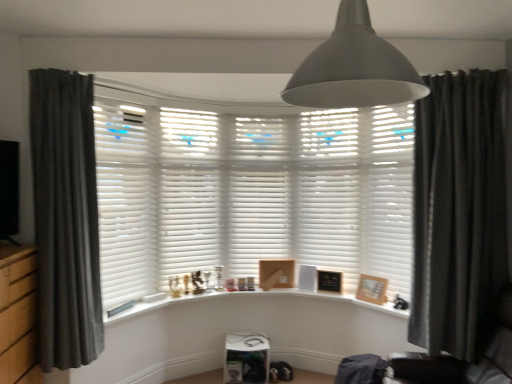
Where is `dark grey velvet curtain at right, placed as the first curtain when sorted from right to left`? dark grey velvet curtain at right, placed as the first curtain when sorted from right to left is located at coordinates point(458,211).

What is the approximate height of matte gray lampshade at upper center?

It is 34.40 centimeters.

Find the location of a particular element. black leather swivel chair at lower right is located at coordinates (460, 360).

Image resolution: width=512 pixels, height=384 pixels. Describe the element at coordinates (258, 194) in the screenshot. I see `white matte shutter at center, which appears as the 3th shutter when viewed from the left` at that location.

Image resolution: width=512 pixels, height=384 pixels. In order to click on white matte shutter at center, which appears as the 5th shutter when viewed from the left in this screenshot , I will do `click(386, 194)`.

Which object is closer to the camera, white wood window sill at center or wooden picture frame at center, positioned as the third picture frame in front-to-back order?

white wood window sill at center is in front.

In terms of size, does white wood window sill at center appear bigger or smaller than wooden picture frame at center, which is the first picture frame in back-to-front order?

white wood window sill at center is bigger than wooden picture frame at center, which is the first picture frame in back-to-front order.

Could wooden picture frame at center, which is the first picture frame in back-to-front order, be considered to be inside white wood window sill at center?

No, wooden picture frame at center, which is the first picture frame in back-to-front order, is not inside white wood window sill at center.

Can you confirm if wooden picture frame at center, which is the first picture frame in back-to-front order, is positioned to the left of white matte shutter at center, which is the 4th shutter from left to right?

Correct, you'll find wooden picture frame at center, which is the first picture frame in back-to-front order, to the left of white matte shutter at center, which is the 4th shutter from left to right.

Do you think wooden picture frame at center, which is the first picture frame in back-to-front order, is within white matte shutter at center, which is the 2th shutter from right to left, or outside of it?

wooden picture frame at center, which is the first picture frame in back-to-front order, is spatially situated outside white matte shutter at center, which is the 2th shutter from right to left.

From a real-world perspective, is wooden picture frame at center, acting as the third picture frame starting from the right, on white matte shutter at center, which is the 4th shutter from left to right?

Incorrect, from a real-world perspective, wooden picture frame at center, acting as the third picture frame starting from the right, is lower than white matte shutter at center, which is the 4th shutter from left to right.

Is black leather swivel chair at lower right behind dark grey fabric curtain at left, which appears as the first curtain when viewed from the left?

No, it is in front of dark grey fabric curtain at left, which appears as the first curtain when viewed from the left.

Can you confirm if black leather swivel chair at lower right is wider than dark grey fabric curtain at left, which ranks as the second curtain in right-to-left order?

Yes, black leather swivel chair at lower right is wider than dark grey fabric curtain at left, which ranks as the second curtain in right-to-left order.

Which is in front, point (495, 356) or point (74, 351)?

The point (495, 356) is in front.

Can you tell me how much black leather swivel chair at lower right and dark grey fabric curtain at left, which ranks as the second curtain in right-to-left order, differ in facing direction?

97.2 degrees.

Relative to white matte shutter at center, the fourth shutter when ordered from right to left, is white matte shutter at center, which is the 1th shutter from right to left, in front or behind?

white matte shutter at center, which is the 1th shutter from right to left, is positioned closer to the viewer than white matte shutter at center, the fourth shutter when ordered from right to left.

Which of these two, white matte shutter at center, which appears as the 5th shutter when viewed from the left, or white matte shutter at center, the 2th shutter from the left, stands shorter?

white matte shutter at center, which appears as the 5th shutter when viewed from the left.

Is white matte shutter at center, which is the 1th shutter from right to left, looking in the opposite direction of white matte shutter at center, the fourth shutter when ordered from right to left?

That's not correct — white matte shutter at center, which is the 1th shutter from right to left, is not looking away from white matte shutter at center, the fourth shutter when ordered from right to left.

Is white matte shutter at center, which is the 1th shutter from right to left, not inside white matte shutter at center, the 2th shutter from the left?

Yes, white matte shutter at center, which is the 1th shutter from right to left, is not within white matte shutter at center, the 2th shutter from the left.

Can you tell me how much white matte shutter at center, which is the 1th shutter from right to left, and white matte shutter at left, the fifth shutter viewed from the right, differ in facing direction?

105 degrees separate the facing orientations of white matte shutter at center, which is the 1th shutter from right to left, and white matte shutter at left, the fifth shutter viewed from the right.

From a real-world perspective, is white matte shutter at center, which is the 1th shutter from right to left, positioned above or below white matte shutter at left, placed as the first shutter when sorted from left to right?

white matte shutter at center, which is the 1th shutter from right to left, is situated lower than white matte shutter at left, placed as the first shutter when sorted from left to right, in the real world.

Is white matte shutter at left, the fifth shutter viewed from the right, a part of white matte shutter at center, which is the 1th shutter from right to left?

No, white matte shutter at left, the fifth shutter viewed from the right, is located outside of white matte shutter at center, which is the 1th shutter from right to left.

Between white matte shutter at center, which appears as the 5th shutter when viewed from the left, and white matte shutter at left, the fifth shutter viewed from the right, which one has more height?

Standing taller between the two is white matte shutter at left, the fifth shutter viewed from the right.

Is white matte shutter at center, the fourth shutter when ordered from right to left, beside white matte shutter at center, which appears as the 3th shutter when viewed from the left?

They are not placed beside each other.

Which shutter is the 1st one when counting from the right side of the white matte shutter at center, the 2th shutter from the left? Please provide its 2D coordinates.

[(258, 194)]

Is the position of white matte shutter at center, the 2th shutter from the left, more distant than that of white matte shutter at center, the third shutter positioned from the right?

No, it is in front of white matte shutter at center, the third shutter positioned from the right.

Does white wood window sill at center come behind white matte shutter at left, the fifth shutter viewed from the right?

Yes, the depth of white wood window sill at center is greater than that of white matte shutter at left, the fifth shutter viewed from the right.

Between white wood window sill at center and white matte shutter at left, placed as the first shutter when sorted from left to right, which one appears on the left side from the viewer's perspective?

From the viewer's perspective, white matte shutter at left, placed as the first shutter when sorted from left to right, appears more on the left side.

Considering the sizes of objects white wood window sill at center and white matte shutter at left, placed as the first shutter when sorted from left to right, in the image provided, who is thinner, white wood window sill at center or white matte shutter at left, placed as the first shutter when sorted from left to right,?

With smaller width is white matte shutter at left, placed as the first shutter when sorted from left to right.

Considering the sizes of objects white wood window sill at center and white matte shutter at left, placed as the first shutter when sorted from left to right, in the image provided, who is smaller, white wood window sill at center or white matte shutter at left, placed as the first shutter when sorted from left to right,?

white wood window sill at center.

The image size is (512, 384). I want to click on the 1st picture frame counting from the right of the white wood window sill at center, so click(x=276, y=274).

Locate an element on the screen. Image resolution: width=512 pixels, height=384 pixels. the 2nd picture frame behind when counting from the white matte shutter at center, which is the 2th shutter from right to left is located at coordinates (276, 274).

From the image, which object appears to be farther from black leather swivel chair at lower right, white matte shutter at center, which appears as the 3th shutter when viewed from the left, or dark grey fabric curtain at left, which ranks as the second curtain in right-to-left order?

dark grey fabric curtain at left, which ranks as the second curtain in right-to-left order, lies further to black leather swivel chair at lower right than the other object.

Based on their spatial positions, is white matte shutter at center, which is the 2th shutter from right to left, or white wood window sill at center closer to dark grey velvet curtain at right, placed as the first curtain when sorted from right to left?

Among the two, white matte shutter at center, which is the 2th shutter from right to left, is located nearer to dark grey velvet curtain at right, placed as the first curtain when sorted from right to left.

Estimate the real-world distances between objects in this image. Which object is closer to black leather swivel chair at lower right, dark grey fabric curtain at left, which ranks as the second curtain in right-to-left order, or black matte picture frame at center, the second picture frame in the right-to-left sequence?

The object closer to black leather swivel chair at lower right is black matte picture frame at center, the second picture frame in the right-to-left sequence.

When comparing their distances from white matte shutter at center, which appears as the 5th shutter when viewed from the left, does white matte shutter at center, which is the 2th shutter from right to left, or black leather swivel chair at lower right seem closer?

white matte shutter at center, which is the 2th shutter from right to left, lies closer to white matte shutter at center, which appears as the 5th shutter when viewed from the left, than the other object.

Considering their positions, is dark grey velvet curtain at right, which is counted as the 2th curtain, starting from the left, positioned closer to white matte shutter at center, which appears as the 3th shutter when viewed from the left, than wooden picture frame at right, which is the 1th picture frame in right-to-left order?

wooden picture frame at right, which is the 1th picture frame in right-to-left order, lies closer to white matte shutter at center, which appears as the 3th shutter when viewed from the left, than the other object.

Based on their spatial positions, is dark grey velvet curtain at right, placed as the first curtain when sorted from right to left, or white matte shutter at center, which appears as the 3th shutter when viewed from the left, closer to white matte shutter at left, the fifth shutter viewed from the right?

Based on the image, white matte shutter at center, which appears as the 3th shutter when viewed from the left, appears to be nearer to white matte shutter at left, the fifth shutter viewed from the right.

Considering their positions, is white matte shutter at left, placed as the first shutter when sorted from left to right, positioned closer to black matte picture frame at center, which is counted as the second picture frame, starting from the back, than wooden picture frame at center, positioned as the third picture frame in front-to-back order?

wooden picture frame at center, positioned as the third picture frame in front-to-back order, is positioned closer to the anchor black matte picture frame at center, which is counted as the second picture frame, starting from the back.

When comparing their distances from matte gray lampshade at upper center, does wooden picture frame at center, which appears as the 1th picture frame when viewed from the left, or black leather swivel chair at lower right seem further?

wooden picture frame at center, which appears as the 1th picture frame when viewed from the left, is positioned further to the anchor matte gray lampshade at upper center.

Identify the location of swivel chair between white matte shutter at left, the fifth shutter viewed from the right, and dark grey velvet curtain at right, placed as the first curtain when sorted from right to left. (460, 360).

Locate an element on the screen. This screenshot has height=384, width=512. window sill between dark grey fabric curtain at left, which appears as the first curtain when viewed from the left, and black leather swivel chair at lower right is located at coordinates (254, 297).

Where is `swivel chair between matte gray lampshade at upper center and white wood window sill at center along the z-axis`? swivel chair between matte gray lampshade at upper center and white wood window sill at center along the z-axis is located at coordinates pos(460,360).

I want to click on swivel chair between matte gray lampshade at upper center and white matte shutter at center, the 2th shutter from the left, from front to back, so click(460, 360).